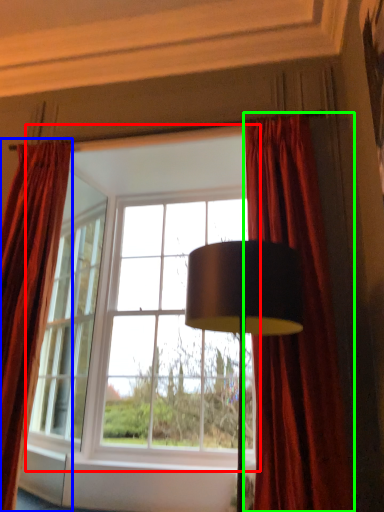
Question: Which object is positioned farthest from window (highlighted by a red box)? Select from curtain (highlighted by a blue box) and curtain (highlighted by a green box).

Choices:
 (A) curtain
 (B) curtain

Answer: (B)